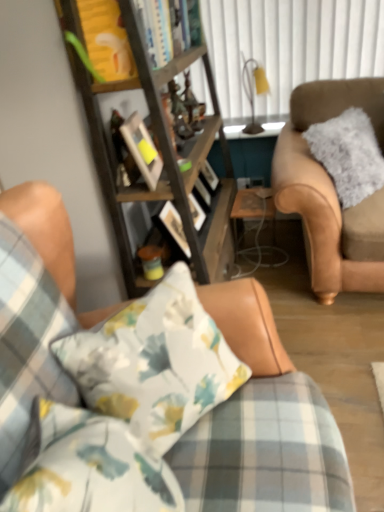
The height and width of the screenshot is (512, 384). What do you see at coordinates (330, 191) in the screenshot? I see `fuzzy beige chair at right` at bounding box center [330, 191].

At what (x,y) coordinates should I click in order to perform the action: click on floral fabric couch at center. Please return your answer as a coordinate pair (x, y). Image resolution: width=384 pixels, height=512 pixels. Looking at the image, I should click on (139, 406).

Is matte brown coffee cup at center completely or partially inside white textured curtain at upper center?

No, white textured curtain at upper center does not contain matte brown coffee cup at center.

Does white textured curtain at upper center appear on the left side of matte brown coffee cup at center?

Incorrect, white textured curtain at upper center is not on the left side of matte brown coffee cup at center.

In order to click on window screen above the matte brown coffee cup at center (from a real-world perspective) in this screenshot , I will do `click(290, 46)`.

Does white textured curtain at upper center have a lesser width compared to matte brown coffee cup at center?

Yes, white textured curtain at upper center is thinner than matte brown coffee cup at center.

From the picture: Which point is more distant from viewer, (237, 7) or (252, 72)?

The point (252, 72) is behind.

Which is behind, white textured curtain at upper center or metallic gold lamp at upper right?

metallic gold lamp at upper right.

Would you say white textured curtain at upper center is outside metallic gold lamp at upper right?

white textured curtain at upper center is positioned outside metallic gold lamp at upper right.

Is there a large distance between white textured curtain at upper center and metallic gold lamp at upper right?

white textured curtain at upper center is near metallic gold lamp at upper right, not far away.

Is fuzzy beige chair at right far from wooden bookshelf at center?

That's not correct — fuzzy beige chair at right is a little close to wooden bookshelf at center.

From the image's perspective, which is below, fuzzy beige chair at right or wooden bookshelf at center?

wooden bookshelf at center appears lower in the image.

Can you confirm if fuzzy beige chair at right is bigger than wooden bookshelf at center?

No, fuzzy beige chair at right is not bigger than wooden bookshelf at center.

Is fuzzy beige chair at right oriented towards wooden bookshelf at center?

No, fuzzy beige chair at right is not turned towards wooden bookshelf at center.

Would you say floral fabric pillow at center is part of fuzzy beige chair at right's contents?

No, floral fabric pillow at center is not surrounded by fuzzy beige chair at right.

Does point (284, 194) come closer to viewer compared to point (82, 368)?

No.

Can you confirm if fuzzy beige chair at right is positioned to the left of floral fabric pillow at center?

In fact, fuzzy beige chair at right is to the right of floral fabric pillow at center.

Considering the sizes of objects fuzzy beige chair at right and floral fabric pillow at center in the image provided, who is thinner, fuzzy beige chair at right or floral fabric pillow at center?

With smaller width is floral fabric pillow at center.

Is floral fabric pillow at center at the left side of wooden picture frame at center?

No.

Is floral fabric pillow at center beside wooden picture frame at center?

No.

How many degrees apart are the facing directions of floral fabric pillow at center and wooden picture frame at center?

There is a 32-degree angle between the facing directions of floral fabric pillow at center and wooden picture frame at center.

Does floral fabric pillow at center come behind wooden picture frame at center?

No, floral fabric pillow at center is closer to the camera.

Locate an element on the screen. This screenshot has height=512, width=384. picture frame lying below the metallic gold lamp at upper right (from the image's perspective) is located at coordinates (142, 149).

Is metallic gold lamp at upper right wider than wooden picture frame at center?

Indeed, metallic gold lamp at upper right has a greater width compared to wooden picture frame at center.

Is metallic gold lamp at upper right not near wooden picture frame at center?

Yes, metallic gold lamp at upper right and wooden picture frame at center are located far from each other.

How many degrees apart are the facing directions of metallic gold lamp at upper right and wooden picture frame at center?

They differ by 99 degrees in their facing directions.

Is wooden picture frame at center next to white textured curtain at upper center?

No, wooden picture frame at center is not beside white textured curtain at upper center.

Considering their positions, is wooden picture frame at center located in front of or behind white textured curtain at upper center?

Visually, wooden picture frame at center is located in front of white textured curtain at upper center.

Image resolution: width=384 pixels, height=512 pixels. I want to click on picture frame below the white textured curtain at upper center (from the image's perspective), so click(142, 149).

Which is nearer, (150, 145) or (236, 19)?

Point (150, 145) appears to be closer to the viewer than point (236, 19).

Find the location of a particular element. window screen above the matte brown coffee cup at center (from a real-world perspective) is located at coordinates (290, 46).

Where is `lamp behind the white textured curtain at upper center`? lamp behind the white textured curtain at upper center is located at coordinates (253, 90).

Based on their spatial positions, is matte brown coffee cup at center or metallic gold lamp at upper right further from white textured curtain at upper center?

Among the two, matte brown coffee cup at center is located further to white textured curtain at upper center.

When comparing their distances from clear glass table at center, does floral fabric couch at center or floral fabric pillow at center seem further?

floral fabric couch at center is positioned further to the anchor clear glass table at center.

Looking at the image, which one is located further to floral fabric couch at center, matte brown coffee cup at center or floral fabric pillow at center?

matte brown coffee cup at center lies further to floral fabric couch at center than the other object.

Considering their positions, is white textured curtain at upper center positioned further to clear glass table at center than matte brown coffee cup at center?

white textured curtain at upper center.

When comparing their distances from wooden bookshelf at center, does metallic gold lamp at upper right or wooden picture frame at center seem further?

metallic gold lamp at upper right is further to wooden bookshelf at center.

Looking at the image, which one is located closer to floral fabric pillow at center, clear glass table at center or wooden picture frame at center?

Based on the image, wooden picture frame at center appears to be nearer to floral fabric pillow at center.

Which object lies further to the anchor point wooden bookshelf at center, fuzzy beige chair at right or clear glass table at center?

fuzzy beige chair at right is positioned further to the anchor wooden bookshelf at center.

Which object lies further to the anchor point wooden bookshelf at center, floral fabric pillow at center or fuzzy beige chair at right?

Among the two, floral fabric pillow at center is located further to wooden bookshelf at center.

The height and width of the screenshot is (512, 384). Find the location of `coffee cup between wooden bookshelf at center and metallic gold lamp at upper right in the front-back direction`. coffee cup between wooden bookshelf at center and metallic gold lamp at upper right in the front-back direction is located at coordinates (151, 261).

Identify the location of picture frame between wooden bookshelf at center and metallic gold lamp at upper right along the z-axis. Image resolution: width=384 pixels, height=512 pixels. (142, 149).

You are a GUI agent. You are given a task and a screenshot of the screen. Output one action in this format:
    pyautogui.click(x=<x>, y=<y>)
    Task: Click on the studio couch between wooden bookshelf at center and floral fabric pillow at center vertically
    
    Given the screenshot: What is the action you would take?
    (139, 406)

Where is `coffee cup located between floral fabric couch at center and metallic gold lamp at upper right in the depth direction`? coffee cup located between floral fabric couch at center and metallic gold lamp at upper right in the depth direction is located at coordinates (151, 261).